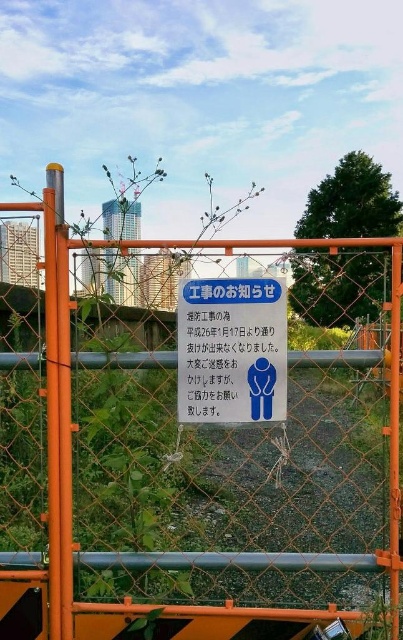
Question: Is orange chain-link fence at center wider than blue paper at center?

Choices:
 (A) yes
 (B) no

Answer: (B)

Question: Which point is farther from the camera taking this photo?

Choices:
 (A) (199, 394)
 (B) (213, 544)

Answer: (B)

Question: In this image, where is orange chain-link fence at center located relative to blue paper at center?

Choices:
 (A) right
 (B) left

Answer: (A)

Question: Does orange chain-link fence at center have a smaller size compared to blue paper at center?

Choices:
 (A) yes
 (B) no

Answer: (B)